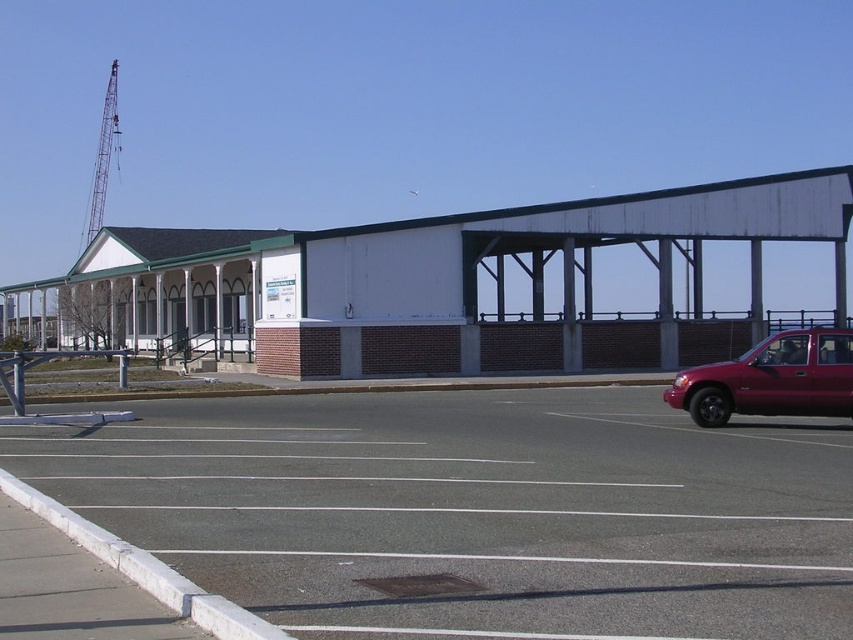
Which is more to the left, gray asphalt parking lot at lower right or glossy red truck at right?

Positioned to the left is gray asphalt parking lot at lower right.

Is gray asphalt parking lot at lower right to the left of glossy red truck at right from the viewer's perspective?

Correct, you'll find gray asphalt parking lot at lower right to the left of glossy red truck at right.

Where is `gray asphalt parking lot at lower right`? gray asphalt parking lot at lower right is located at coordinates (474, 513).

This screenshot has height=640, width=853. In order to click on gray asphalt parking lot at lower right in this screenshot , I will do pyautogui.click(x=474, y=513).